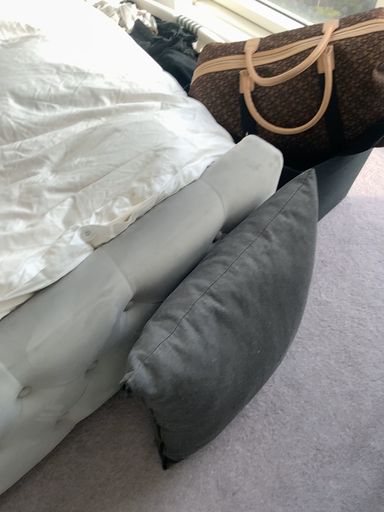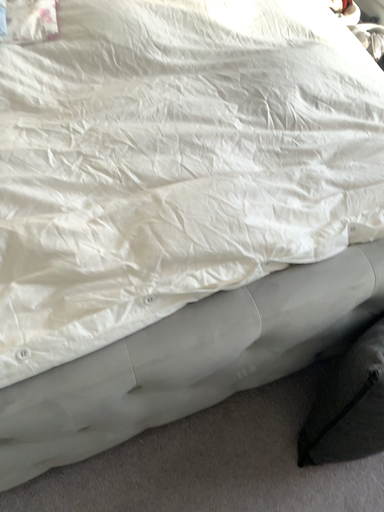
Question: How did the camera likely rotate when shooting the video?

Choices:
 (A) rotated left
 (B) rotated right

Answer: (A)